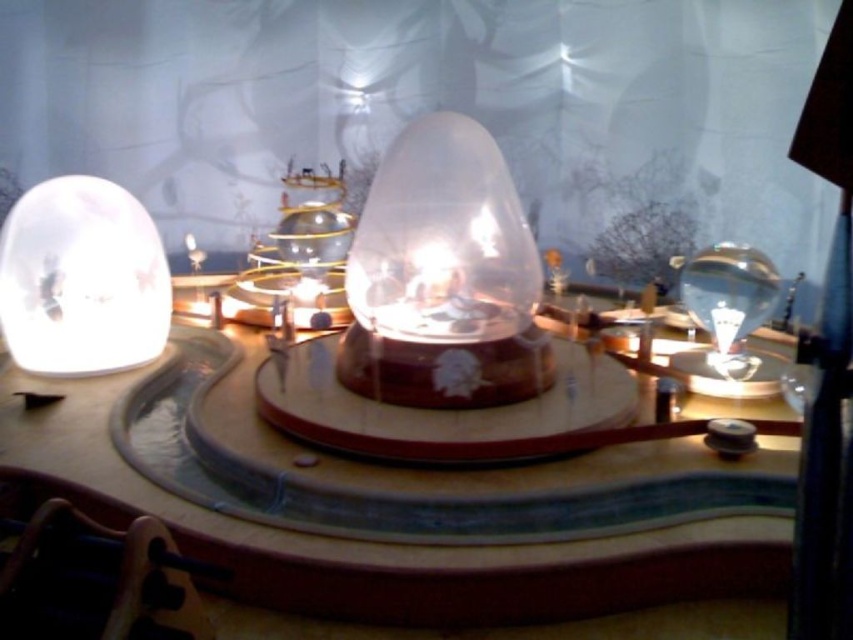
You are standing in front of the translucent glass table at center. Looking towards the direction where the translucent glass globe at left is placed, which side of the table should you walk around to reach the globe?

Since the translucent glass table at center is to the right of the translucent glass globe at left, you should walk around the left side of the translucent glass table at center to reach the globe.

You are standing at point 0.5, 0.5 in the room. You want to place a heavy object on the translucent glass table at center. Is the table within your reach?

The translucent glass table at center is located at point [392,502], which is approximately 0.319 units away from your current position at [426,320]. If this distance is within your reach, then yes, you can place the object there. However, the exact reach capability isn answerable with the provided information.

Looking at this image, you are a visitor at the museum and want to touch the transparent glass dome at center. Can you reach it without moving the translucent glass table at center?

The translucent glass table at center is in front of the transparent glass dome at center, so you cannot reach the transparent glass dome at center without moving the translucent glass table at center first.